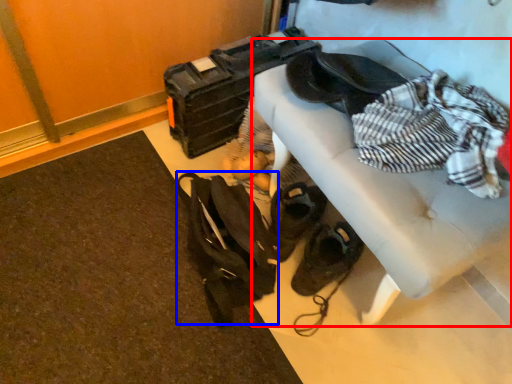
Question: Among these objects, which one is nearest to the camera, furniture (highlighted by a red box) or messenger bag (highlighted by a blue box)?

Choices:
 (A) furniture
 (B) messenger bag

Answer: (A)